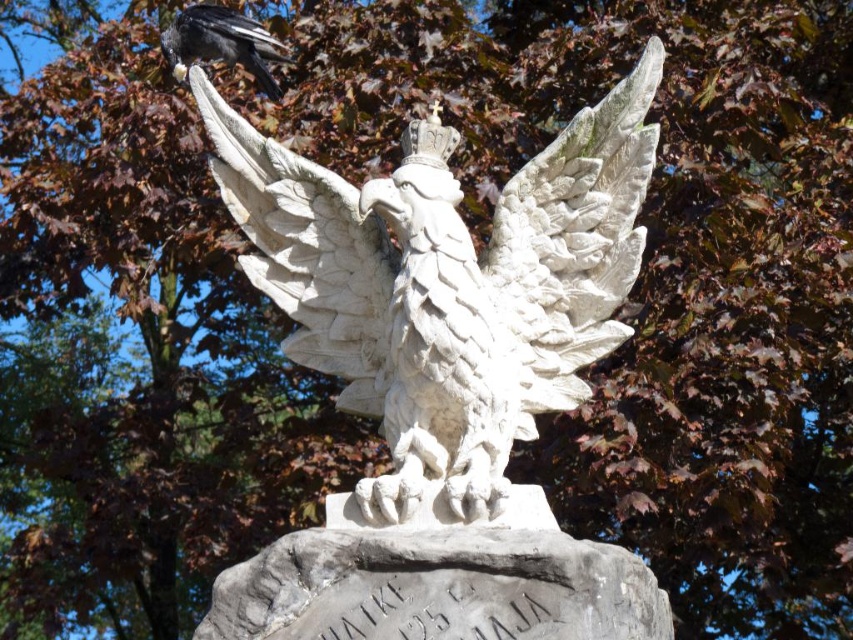
You are an art student observing the sculpture of the white stone eagle at center and the shiny black raven at upper left. Which of these two birds is bigger in the artwork?

The white stone eagle at center is larger than the shiny black raven at upper left.

You are an art conservator examining the sculpture of the crowned eagle. You notice two points on the sculpture marked at coordinates point (318, 189) and point (271, 83). Which point is positioned closer to your viewpoint?

Point (318, 189) is closer to the viewer than point (271, 83).